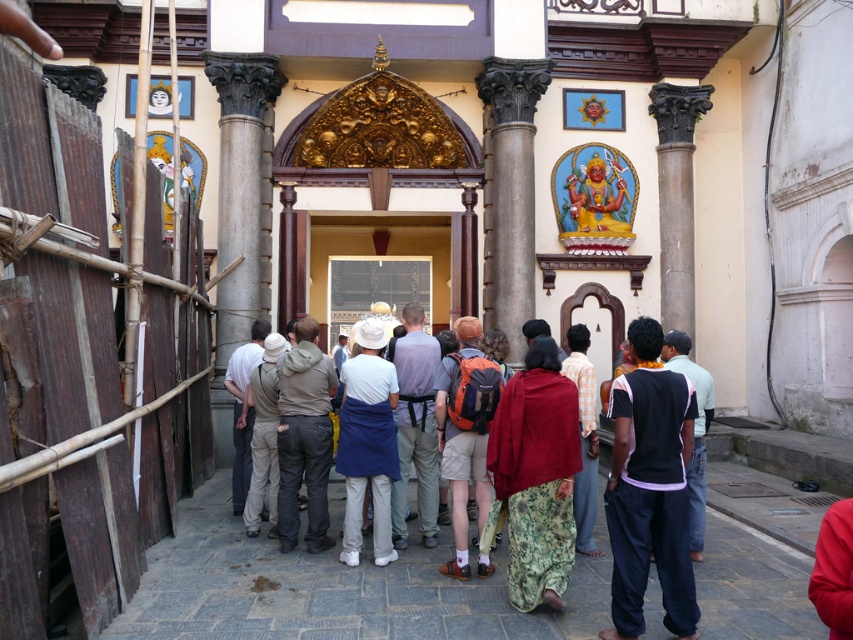
Is the position of black cotton shirt at center more distant than that of white cotton hat at center?

That is False.

Is point (642, 566) positioned after point (376, 480)?

That is False.

Locate an element on the screen. This screenshot has width=853, height=640. black cotton shirt at center is located at coordinates (648, 488).

Is point (518, 545) more distant than point (442, 369)?

No, it is not.

Does multicolored clothing at center appear on the right side of orange fabric backpack at center?

No, multicolored clothing at center is not to the right of orange fabric backpack at center.

Does point (543, 584) come in front of point (468, 387)?

Yes.

You are a GUI agent. You are given a task and a screenshot of the screen. Output one action in this format:
    pyautogui.click(x=<x>, y=<y>)
    Task: Click on the multicolored clothing at center
    This screenshot has width=853, height=640.
    Given the screenshot: What is the action you would take?
    pyautogui.click(x=517, y=468)

Who is more forward, (567, 536) or (445, 385)?

Point (567, 536) is in front.

Can you confirm if green floral saree at center is shorter than orange fabric backpack at center?

Yes, green floral saree at center is shorter than orange fabric backpack at center.

Who is more forward, (538,584) or (461,323)?

Point (538,584)

Where is `green floral saree at center`? The height and width of the screenshot is (640, 853). green floral saree at center is located at coordinates (537, 474).